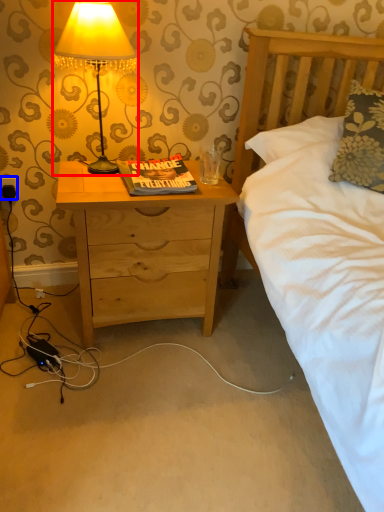
Question: Which of the following is the farthest to the observer, lamp (highlighted by a red box) or electric outlet (highlighted by a blue box)?

Choices:
 (A) lamp
 (B) electric outlet

Answer: (B)